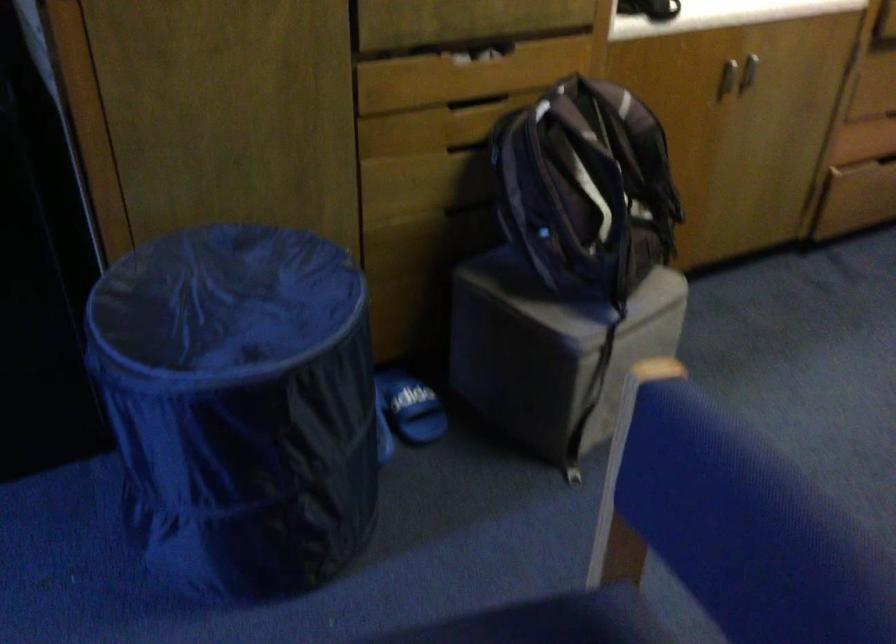
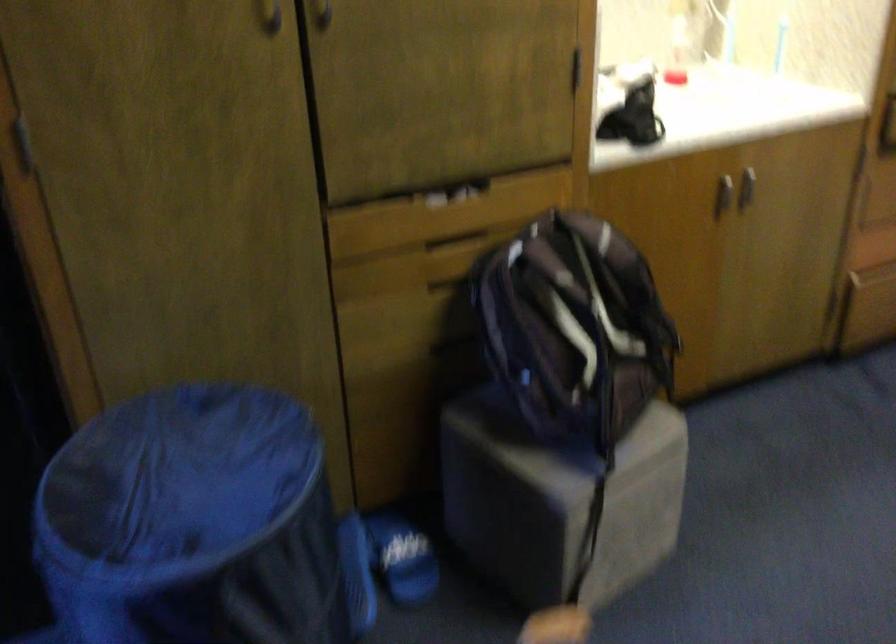
In the second image, find the point that corresponds to (x=570, y=295) in the first image.

(556, 442)